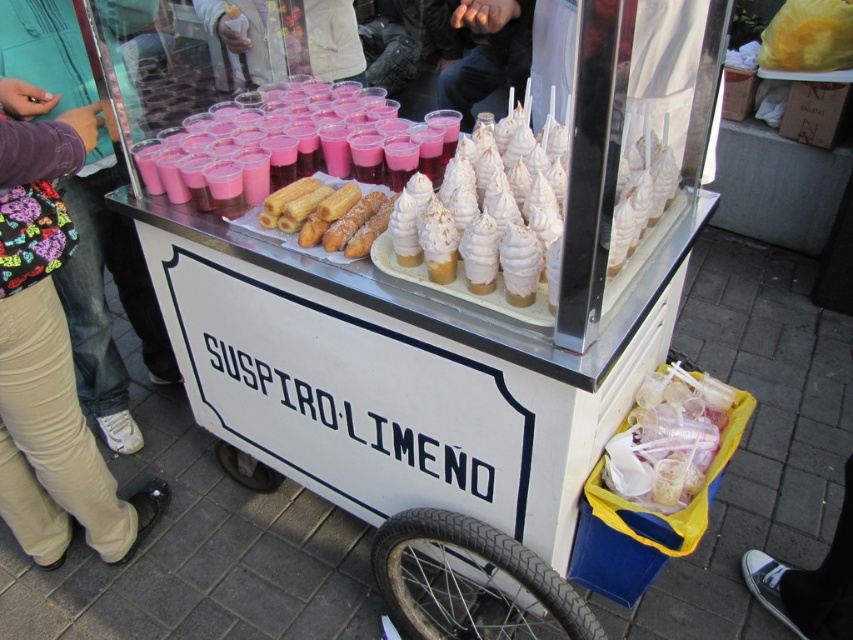
Who is more distant from viewer, (35, 138) or (671, 500)?

Positioned behind is point (671, 500).

Which is above, tan pants at lower left or clear plastic cups at lower right?

tan pants at lower left is above.

Who is more forward, (74, 387) or (676, 449)?

Point (676, 449) is in front.

Locate an element on the screen. tan pants at lower left is located at coordinates (49, 349).

Between point (213, 54) and point (346, 257), which one is positioned in front?

Point (346, 257)

Is white cotton shirt at upper center above golden fried pastry at center?

Yes.

Does point (196, 12) lie behind point (361, 195)?

Yes, point (196, 12) is behind point (361, 195).

Where is `white cotton shirt at upper center`? The image size is (853, 640). white cotton shirt at upper center is located at coordinates (281, 40).

Is white whipped cream at center to the right of white cotton shirt at upper center from the viewer's perspective?

Indeed, white whipped cream at center is positioned on the right side of white cotton shirt at upper center.

From the picture: Who is lower down, white whipped cream at center or white cotton shirt at upper center?

white whipped cream at center

Is point (383, 262) positioned after point (224, 88)?

No, it is in front of (224, 88).

The image size is (853, 640). What are the coordinates of `white whipped cream at center` in the screenshot? It's located at 492,221.